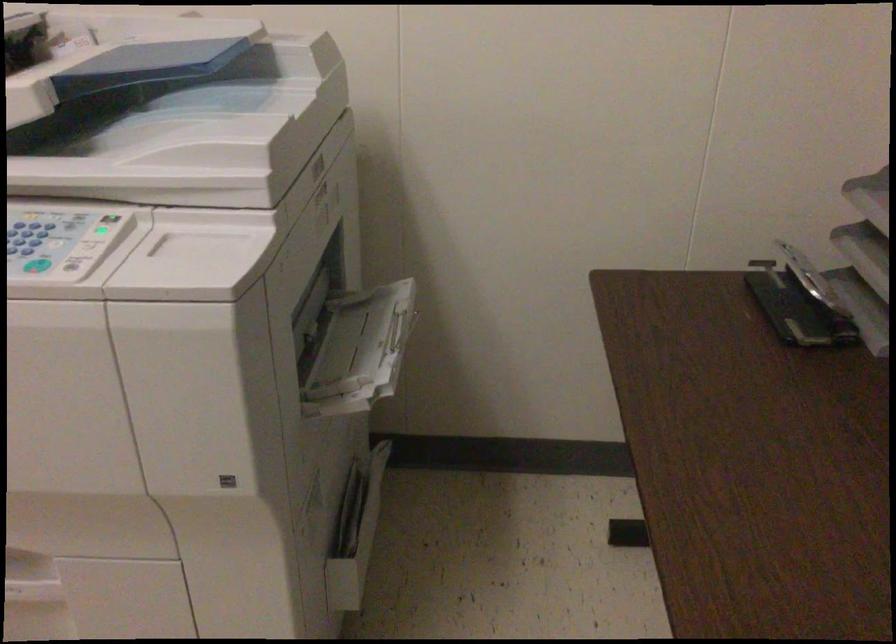
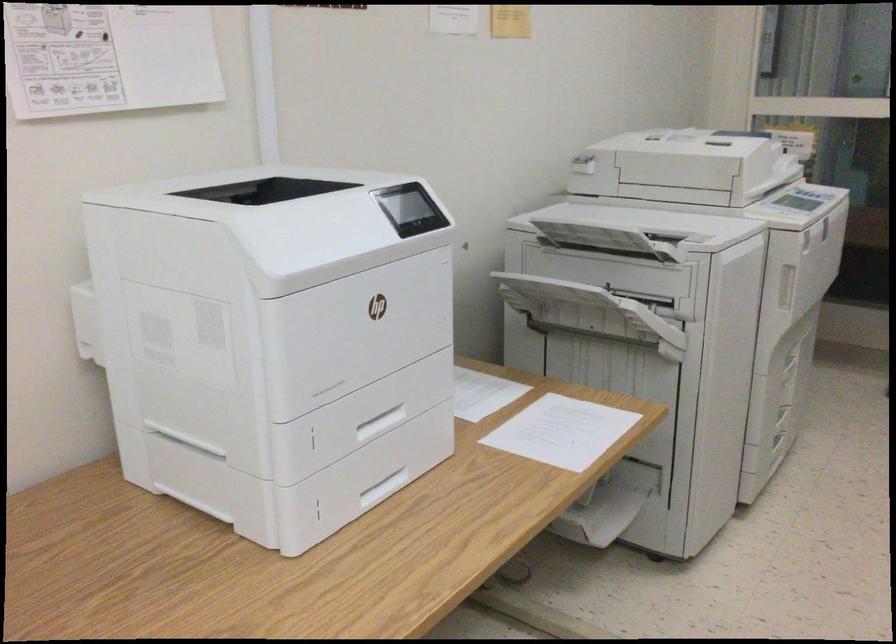
Question: I am providing you with two images of the same scene from different viewpoints. Which of the following objects are not visible in image2?

Choices:
 (A) copier output tray
 (B) open paper tray
 (C) printer tray handle
 (D) utility cart handle

Answer: (B)